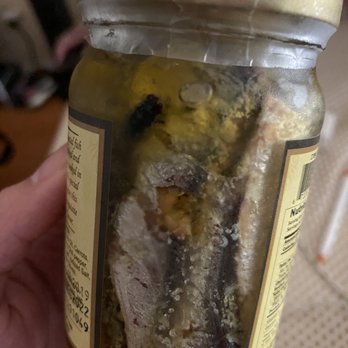
Where is `pen`? pen is located at coordinates (331, 232).